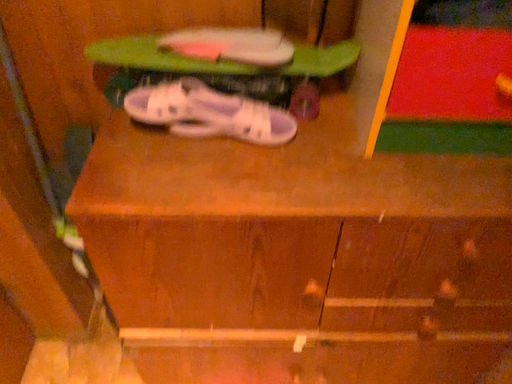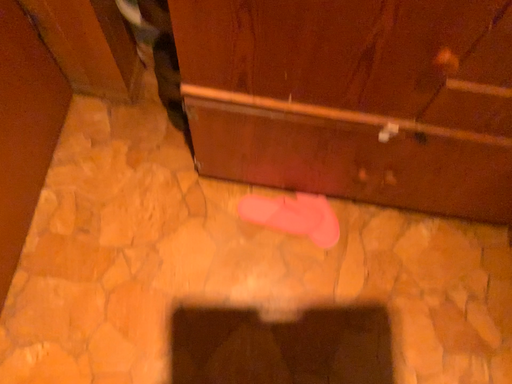
Question: How did the camera likely rotate when shooting the video?

Choices:
 (A) rotated downward
 (B) rotated upward

Answer: (A)